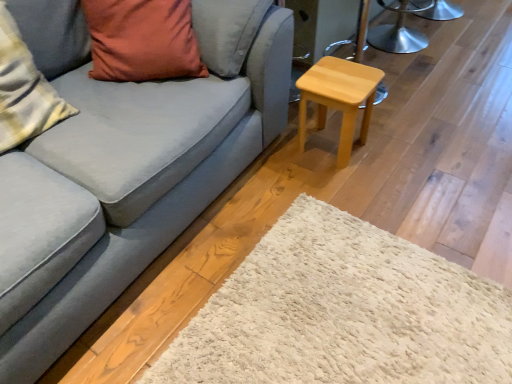
Question: Could matte gray couch at center be considered to be inside plush cotton pillow at left, which appears as the 1th pillow when viewed from the left?

Choices:
 (A) yes
 (B) no

Answer: (B)

Question: From a real-world perspective, is plush cotton pillow at left, which appears as the 1th pillow when viewed from the left, on top of matte gray couch at center?

Choices:
 (A) yes
 (B) no

Answer: (A)

Question: Does plush cotton pillow at left, arranged as the second pillow when viewed from the right, have a larger size compared to matte gray couch at center?

Choices:
 (A) yes
 (B) no

Answer: (B)

Question: Is plush cotton pillow at left, which appears as the 1th pillow when viewed from the left, positioned far away from matte gray couch at center?

Choices:
 (A) yes
 (B) no

Answer: (B)

Question: Does plush cotton pillow at left, arranged as the second pillow when viewed from the right, have a greater height compared to matte gray couch at center?

Choices:
 (A) yes
 (B) no

Answer: (B)

Question: Is light wood/stained stool at right situated inside plush cotton pillow at left, which appears as the 1th pillow when viewed from the left, or outside?

Choices:
 (A) outside
 (B) inside

Answer: (A)

Question: Is light wood/stained stool at right in front of or behind plush cotton pillow at left, which appears as the 1th pillow when viewed from the left, in the image?

Choices:
 (A) behind
 (B) front

Answer: (A)

Question: Considering the positions of light wood/stained stool at right and plush cotton pillow at left, arranged as the second pillow when viewed from the right, in the image, is light wood/stained stool at right bigger or smaller than plush cotton pillow at left, arranged as the second pillow when viewed from the right,?

Choices:
 (A) small
 (B) big

Answer: (A)

Question: Visually, is light wood/stained stool at right positioned to the left or to the right of plush cotton pillow at left, which appears as the 1th pillow when viewed from the left?

Choices:
 (A) left
 (B) right

Answer: (B)

Question: Relative to metallic silver stool at upper right, is light wood/stained stool at right in front or behind?

Choices:
 (A) behind
 (B) front

Answer: (B)

Question: Visually, is light wood/stained stool at right positioned to the left or to the right of metallic silver stool at upper right?

Choices:
 (A) left
 (B) right

Answer: (A)

Question: Considering the positions of point click(343, 139) and point click(381, 39), is point click(343, 139) closer or farther from the camera than point click(381, 39)?

Choices:
 (A) farther
 (B) closer

Answer: (B)

Question: From a real-world perspective, relative to metallic silver stool at upper right, is light wood/stained stool at right vertically above or below?

Choices:
 (A) below
 (B) above

Answer: (A)

Question: From the image's perspective, is metallic silver stool at upper right located above or below plush cotton pillow at left, arranged as the second pillow when viewed from the right?

Choices:
 (A) above
 (B) below

Answer: (A)

Question: In terms of width, does metallic silver stool at upper right look wider or thinner when compared to plush cotton pillow at left, arranged as the second pillow when viewed from the right?

Choices:
 (A) thin
 (B) wide

Answer: (B)